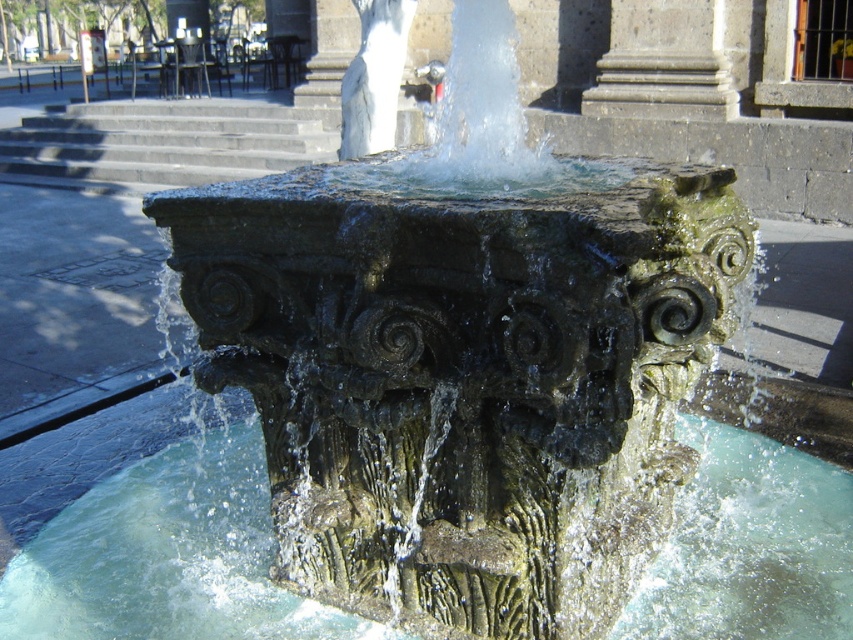
Is point (643, 612) behind point (679, 12)?

No.

Between green mossy stone water at center and gray stone column at center, which one has less height?

green mossy stone water at center

Is point (733, 596) farther from camera compared to point (637, 76)?

No.

Locate an element on the screen. This screenshot has width=853, height=640. green mossy stone water at center is located at coordinates (167, 556).